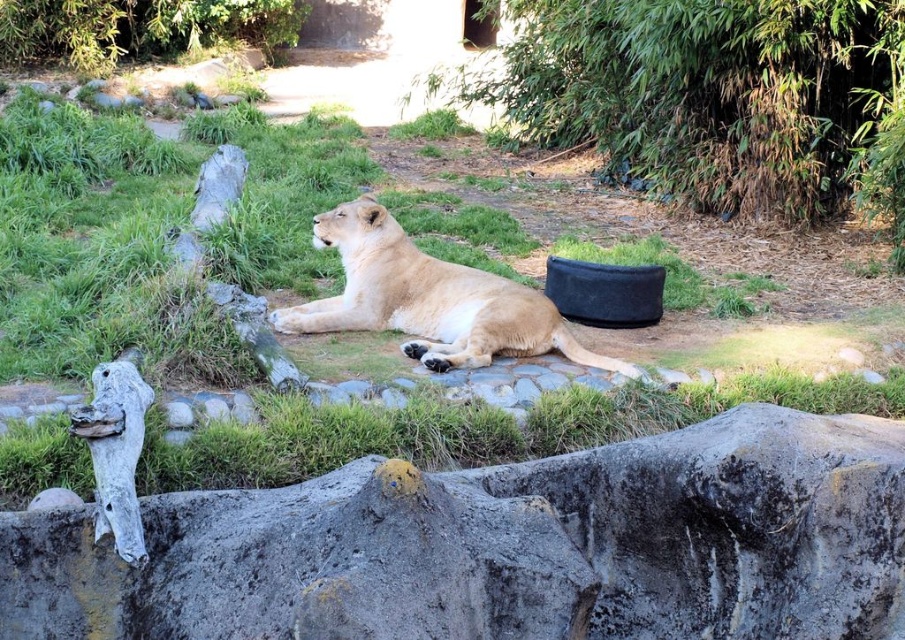
Question: Which point is closer to the camera taking this photo?

Choices:
 (A) (226, 253)
 (B) (899, 580)
 (C) (346, 216)

Answer: (B)

Question: In this image, where is rough gray rock at lower center located relative to light brown fur at center?

Choices:
 (A) above
 (B) below

Answer: (B)

Question: Is green grass at center to the right of light brown fur at center from the viewer's perspective?

Choices:
 (A) no
 (B) yes

Answer: (A)

Question: Does green grass at center appear on the left side of light brown fur at center?

Choices:
 (A) yes
 (B) no

Answer: (A)

Question: Which of these objects is positioned closest to the green grass at center?

Choices:
 (A) rough gray rock at lower center
 (B) light brown fur at center

Answer: (B)

Question: Among these points, which one is farthest from the camera?

Choices:
 (A) (708, 488)
 (B) (65, 467)

Answer: (B)